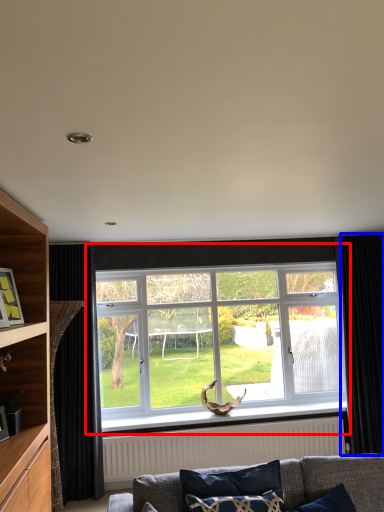
Question: Which point is closer to the camera, window (highlighted by a red box) or curtain (highlighted by a blue box)?

Choices:
 (A) window
 (B) curtain

Answer: (B)